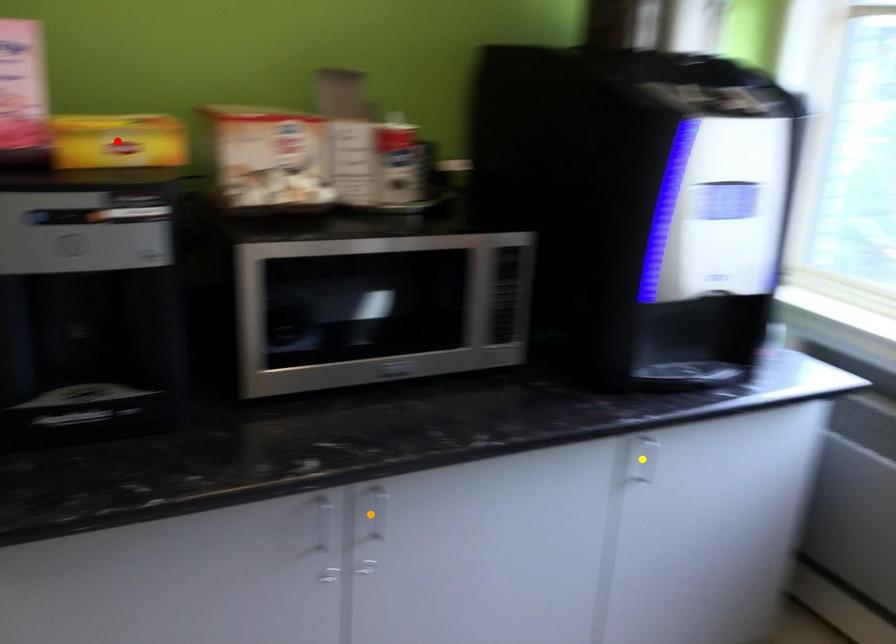
Order these from farthest to nearest:
A) yellow point
B) red point
C) orange point

yellow point < orange point < red point